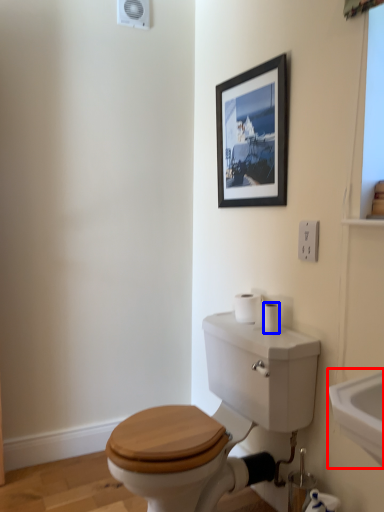
Question: Which of the following is the closest to the observer, sink (highlighted by a red box) or toilet paper (highlighted by a blue box)?

Choices:
 (A) sink
 (B) toilet paper

Answer: (A)